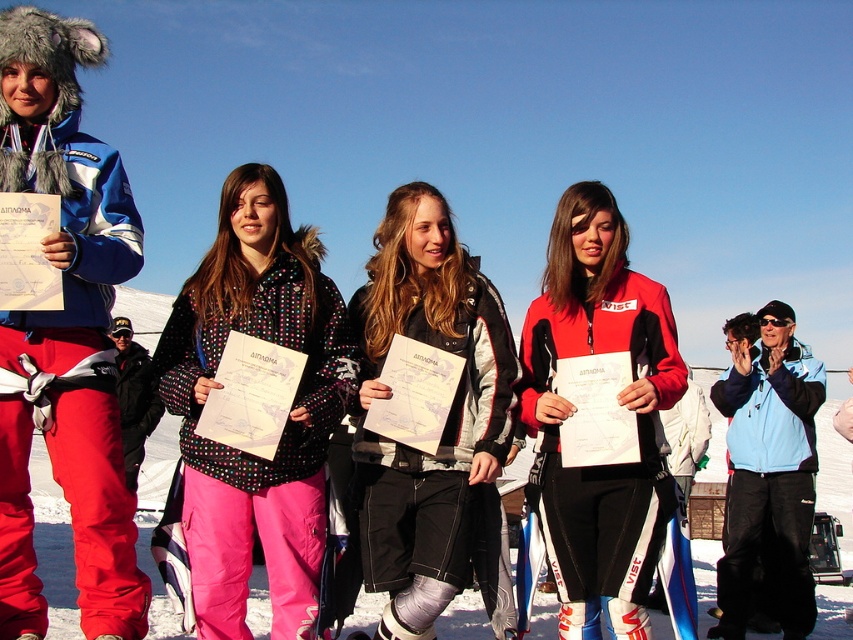
Question: Is polka dot jacket at center to the right of light blue fleece jacket at right from the viewer's perspective?

Choices:
 (A) no
 (B) yes

Answer: (A)

Question: In this image, where is polka dot jacket at center located relative to light blue fleece jacket at right?

Choices:
 (A) right
 (B) left

Answer: (B)

Question: Which object appears farthest from the camera in this image?

Choices:
 (A) polka dot jacket at center
 (B) black leather jacket at center

Answer: (A)

Question: Does red matte jacket at center appear under polka dot jacket at center?

Choices:
 (A) yes
 (B) no

Answer: (A)

Question: Which of the following is the farthest from the observer?

Choices:
 (A) polka dot jacket at center
 (B) matte blue jacket at left
 (C) red matte jacket at center
 (D) light blue fleece jacket at right

Answer: (D)

Question: Which of the following is the farthest from the observer?

Choices:
 (A) (184, 442)
 (B) (45, 113)
 (C) (556, 310)

Answer: (C)